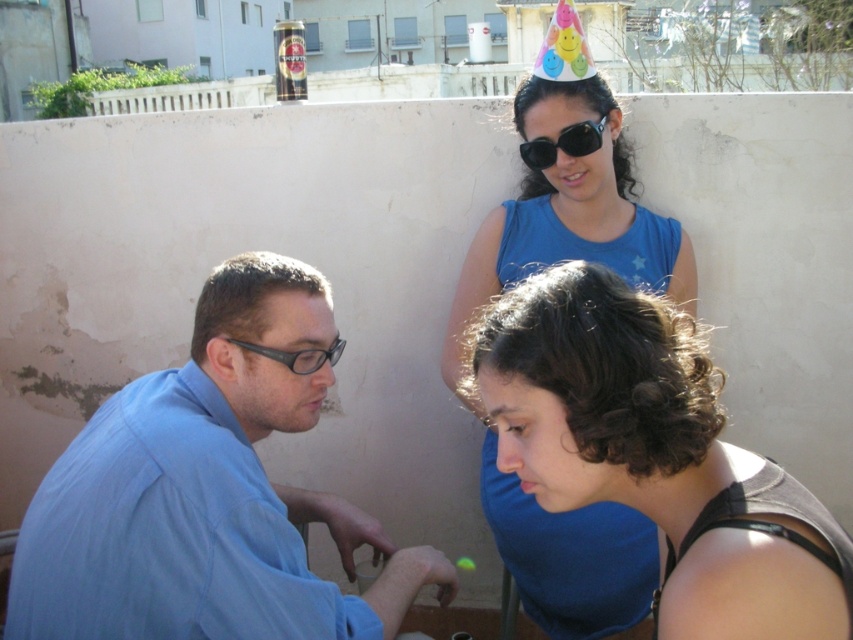
Does blue shirt at left have a larger size compared to black matte sunglasses at upper center?

Yes.

Is point (242, 257) farther from viewer compared to point (566, 129)?

No, (242, 257) is closer to viewer.

What do you see at coordinates (207, 493) in the screenshot? The image size is (853, 640). I see `blue shirt at left` at bounding box center [207, 493].

Where is `blue shirt at left`? blue shirt at left is located at coordinates (207, 493).

Can you confirm if black matte sunglasses at upper center is wider than matte black glasses at left?

Yes, black matte sunglasses at upper center is wider than matte black glasses at left.

Who is higher up, black matte sunglasses at upper center or matte black glasses at left?

black matte sunglasses at upper center

Does point (521, 147) come behind point (287, 358)?

Yes.

At what (x,y) coordinates should I click in order to perform the action: click on black matte sunglasses at upper center. Please return your answer as a coordinate pair (x, y). Looking at the image, I should click on (563, 145).

Which is more to the left, blue fabric dress at upper center or black matte sunglasses at upper center?

Positioned to the left is blue fabric dress at upper center.

Is blue fabric dress at upper center smaller than black matte sunglasses at upper center?

Incorrect, blue fabric dress at upper center is not smaller in size than black matte sunglasses at upper center.

Is point (529, 177) positioned in front of point (573, 131)?

No, (529, 177) is behind (573, 131).

I want to click on blue fabric dress at upper center, so (569, 212).